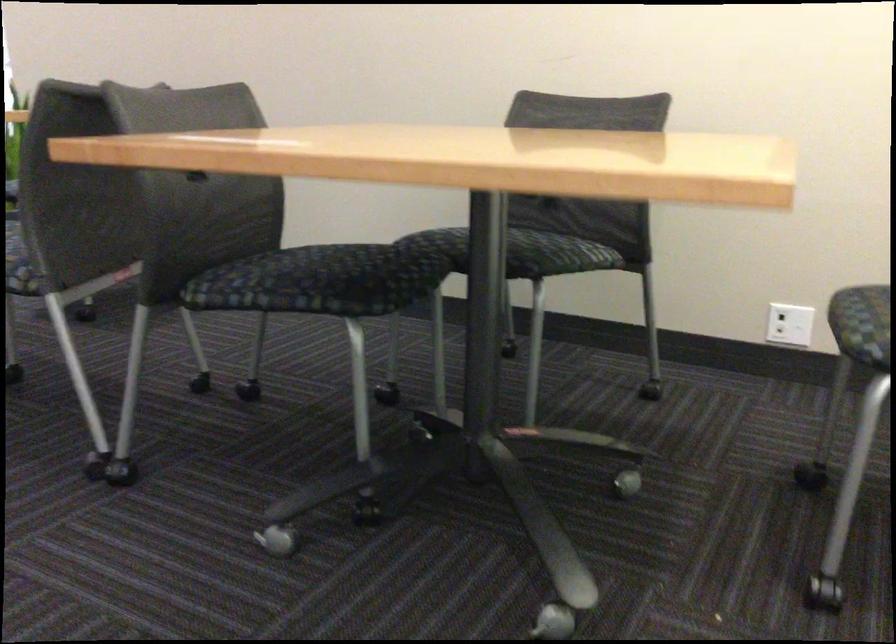
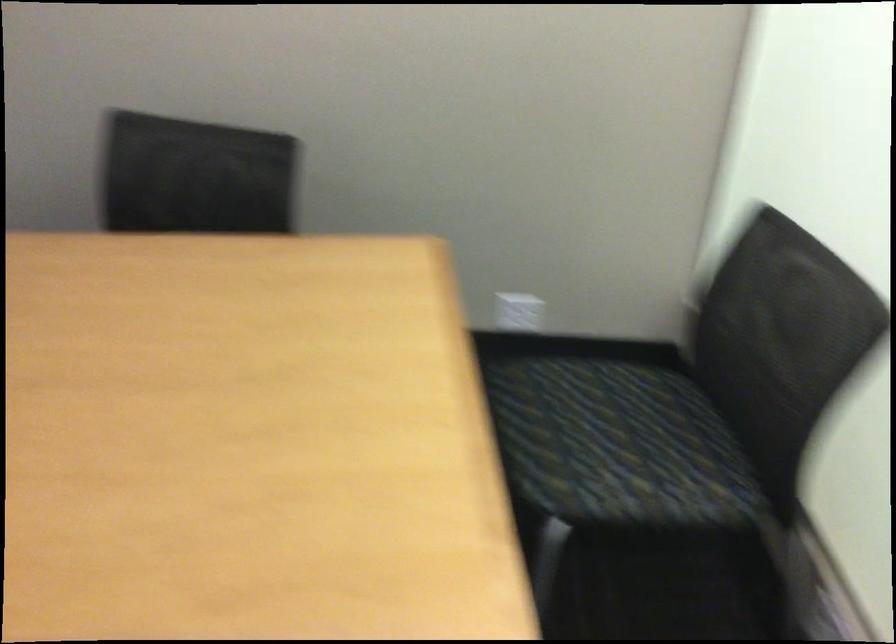
Based on the continuous images, in which direction is the camera rotating?

The camera's rotation is toward right-down.